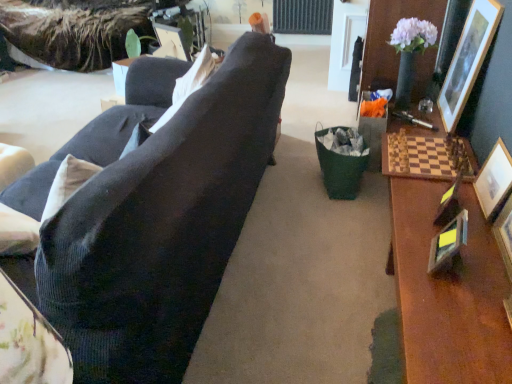
Question: Is white fabric pillow at upper center bigger than wooden picture frame at right, placed as the 5th picture frame when sorted from left to right?

Choices:
 (A) yes
 (B) no

Answer: (A)

Question: Is white fabric pillow at upper center oriented towards wooden picture frame at right, the second picture frame positioned from the right?

Choices:
 (A) yes
 (B) no

Answer: (B)

Question: Considering the relative positions of white fabric pillow at upper center and wooden picture frame at right, the second picture frame positioned from the right, in the image provided, is white fabric pillow at upper center in front of wooden picture frame at right, the second picture frame positioned from the right,?

Choices:
 (A) no
 (B) yes

Answer: (A)

Question: From the image's perspective, would you say white fabric pillow at upper center is shown under wooden picture frame at right, placed as the 5th picture frame when sorted from left to right?

Choices:
 (A) no
 (B) yes

Answer: (A)

Question: From the image's perspective, is white fabric pillow at upper center located above wooden picture frame at right, the second picture frame positioned from the right?

Choices:
 (A) yes
 (B) no

Answer: (A)

Question: From a real-world perspective, is white fabric pillow at upper center located beneath wooden picture frame at right, the second picture frame positioned from the right?

Choices:
 (A) yes
 (B) no

Answer: (B)

Question: Is metallic gold picture frame at right, the 4th picture frame from the right, located outside wooden picture frame at right, acting as the 3th picture frame starting from the right?

Choices:
 (A) no
 (B) yes

Answer: (B)

Question: From the image's perspective, would you say metallic gold picture frame at right, the 4th picture frame from the right, is shown under wooden picture frame at right, acting as the 3th picture frame starting from the right?

Choices:
 (A) yes
 (B) no

Answer: (B)

Question: Is there a large distance between metallic gold picture frame at right, the 4th picture frame from the right, and wooden picture frame at right, acting as the 3th picture frame starting from the right?

Choices:
 (A) yes
 (B) no

Answer: (B)

Question: Can you confirm if metallic gold picture frame at right, placed as the 3th picture frame when sorted from left to right, is shorter than wooden picture frame at right, acting as the 3th picture frame starting from the right?

Choices:
 (A) yes
 (B) no

Answer: (A)

Question: Considering the relative positions of metallic gold picture frame at right, placed as the 3th picture frame when sorted from left to right, and wooden picture frame at right, acting as the 3th picture frame starting from the right, in the image provided, is metallic gold picture frame at right, placed as the 3th picture frame when sorted from left to right, behind wooden picture frame at right, acting as the 3th picture frame starting from the right,?

Choices:
 (A) yes
 (B) no

Answer: (A)

Question: Does metallic gold picture frame at right, the 4th picture frame from the right, lie in front of wooden picture frame at right, the 4th picture frame when ordered from left to right?

Choices:
 (A) no
 (B) yes

Answer: (A)

Question: Can you confirm if white fabric pillow at upper center is taller than metallic silver picture frame at right, positioned as the fifth picture frame in right-to-left order?

Choices:
 (A) yes
 (B) no

Answer: (A)